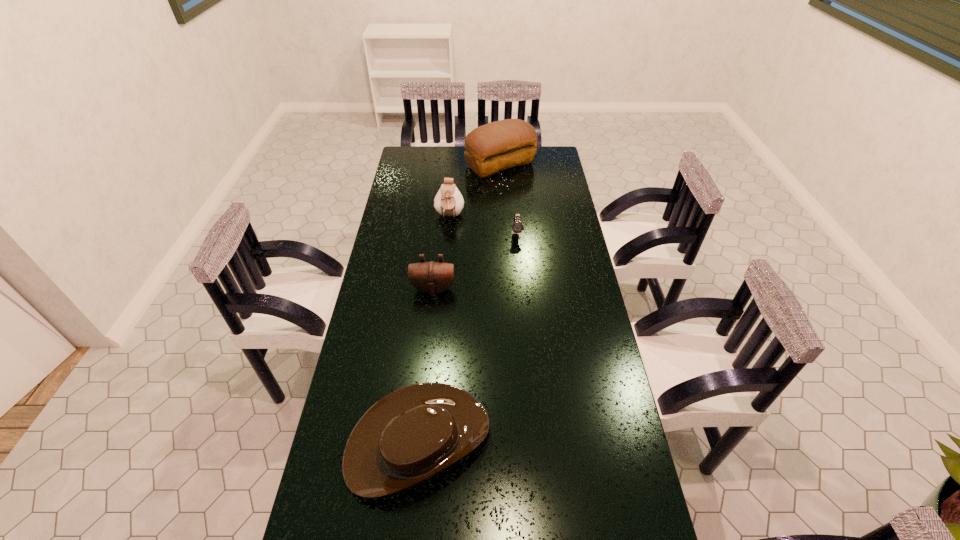
Find the location of `vacant space at the right edge of the desktop`. vacant space at the right edge of the desktop is located at coordinates (571, 343).

You are a GUI agent. You are given a task and a screenshot of the screen. Output one action in this format:
    pyautogui.click(x=<x>, y=<y>)
    Task: Click on the vacant space at the far left corner of the desktop
    Image resolution: width=960 pixels, height=540 pixels.
    Given the screenshot: What is the action you would take?
    point(428,163)

This screenshot has height=540, width=960. I want to click on free spot at the far right corner of the desktop, so click(x=541, y=156).

This screenshot has height=540, width=960. Find the location of `vacant area that lies between the shorter pouch and the fourth nearest object`. vacant area that lies between the shorter pouch and the fourth nearest object is located at coordinates (442, 253).

You are a GUI agent. You are given a task and a screenshot of the screen. Output one action in this format:
    pyautogui.click(x=<x>, y=<y>)
    Task: Click on the free point between the third farthest object and the cowboy hat
    The height and width of the screenshot is (540, 960).
    Given the screenshot: What is the action you would take?
    pyautogui.click(x=468, y=337)

Where is `empty space between the farther pouch and the third farthest object`? The width and height of the screenshot is (960, 540). empty space between the farther pouch and the third farthest object is located at coordinates (483, 225).

Find the location of `free point between the watch and the taller pouch`. free point between the watch and the taller pouch is located at coordinates (483, 225).

Image resolution: width=960 pixels, height=540 pixels. I want to click on vacant area that lies between the farthest object and the second nearest object, so click(467, 227).

Locate an element on the screen. This screenshot has height=540, width=960. free area in between the tallest object and the shorter pouch is located at coordinates (467, 227).

Locate an element on the screen. This screenshot has width=960, height=540. empty space between the nearest object and the tallest object is located at coordinates (460, 302).